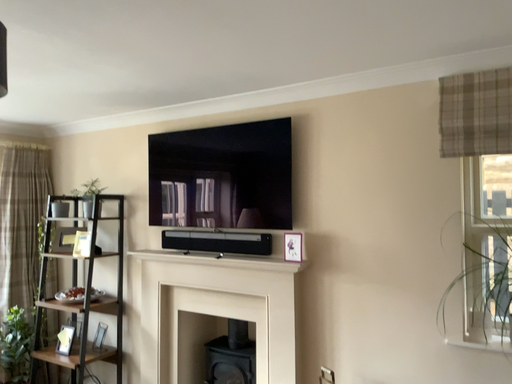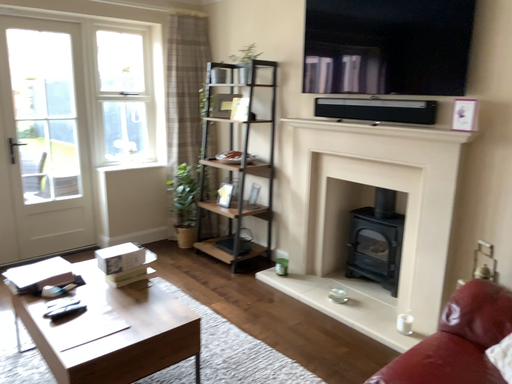
Question: Which way did the camera rotate in the video?

Choices:
 (A) rotated downward
 (B) rotated upward

Answer: (A)